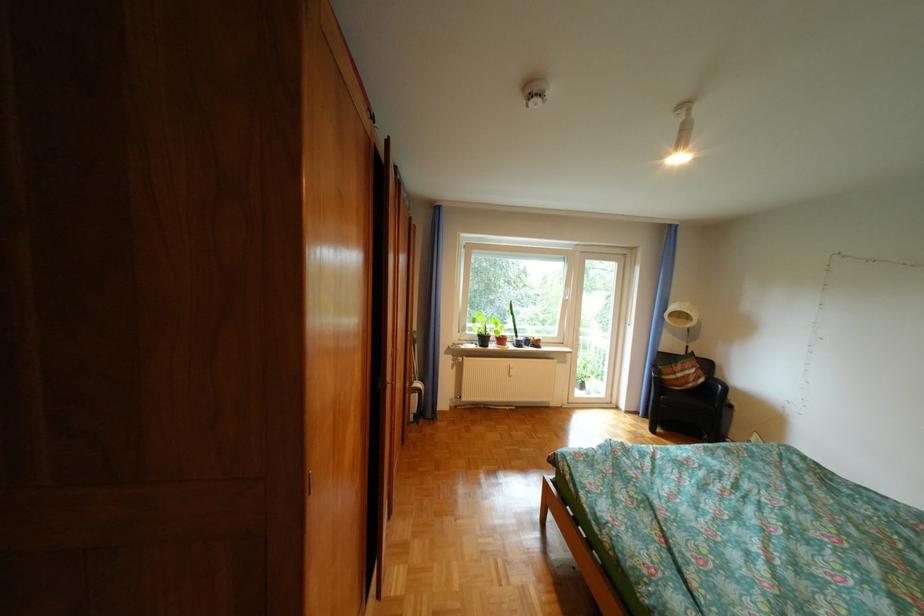
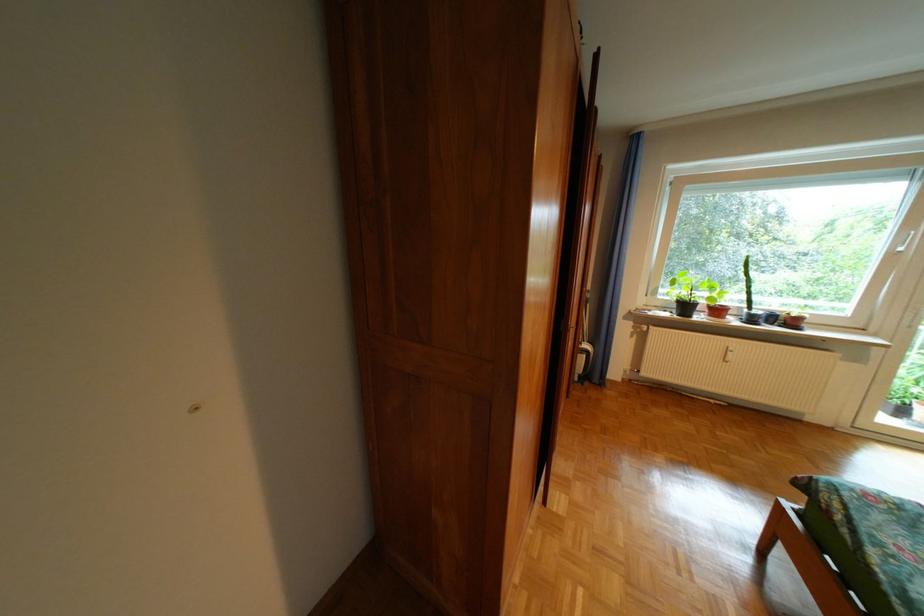
In the second image, find the point that corresponds to point 521,331 in the first image.

(747, 300)